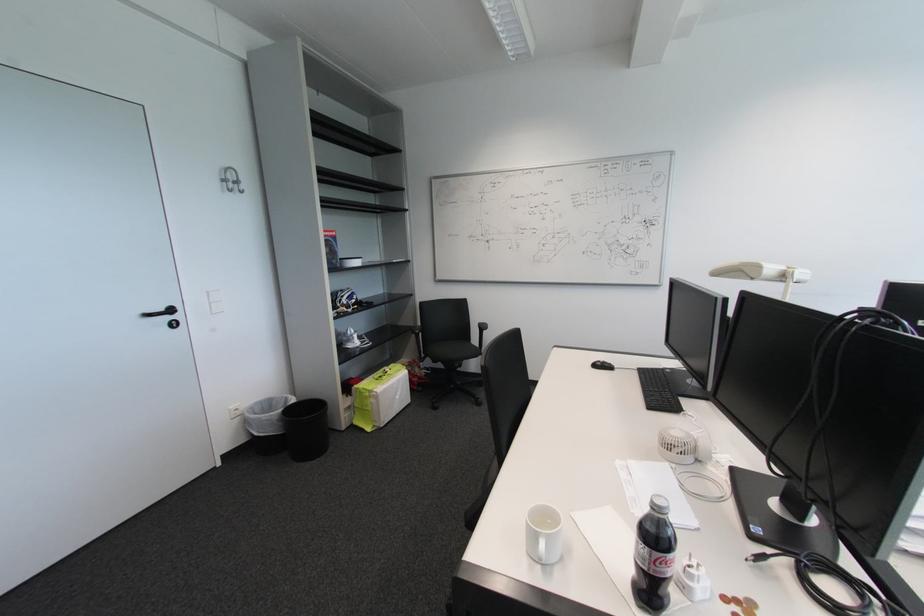
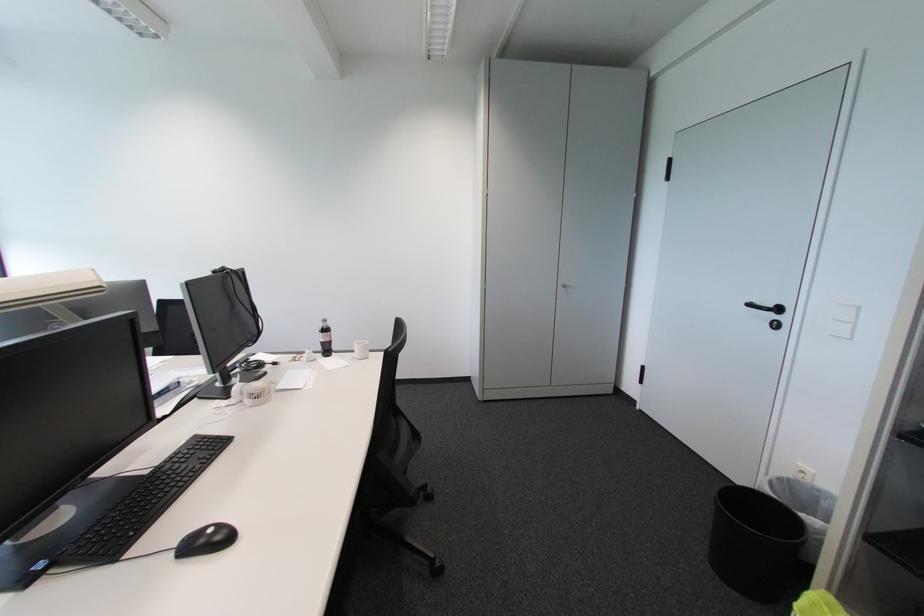
Where in the second image is the point corresponding to point 175,320 from the first image?

(777, 317)